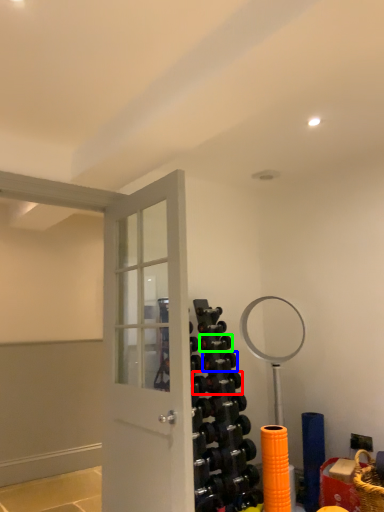
Question: Which is nearer to the dumbbell (highlighted by a red box)? dumbbell (highlighted by a blue box) or dumbbell (highlighted by a green box).

Choices:
 (A) dumbbell
 (B) dumbbell

Answer: (A)